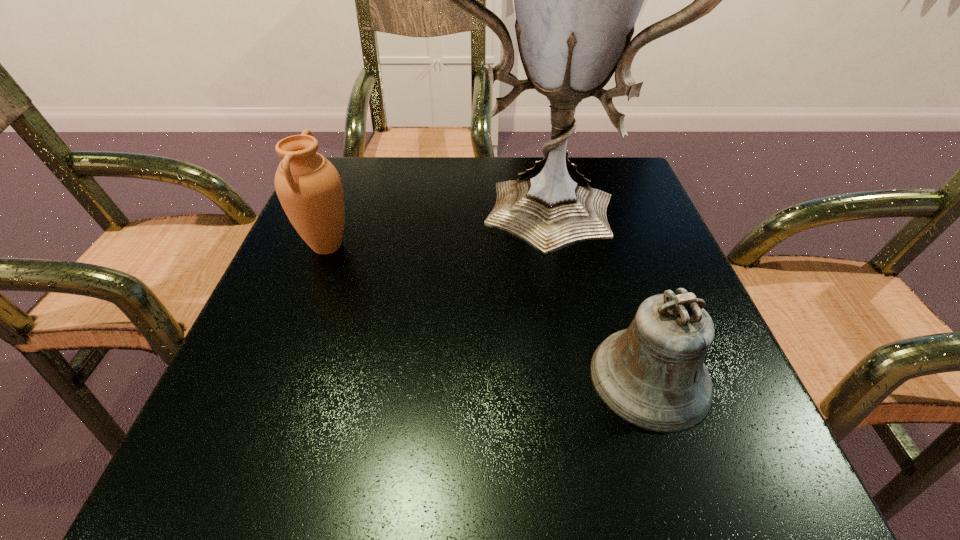
This screenshot has width=960, height=540. I want to click on empty location between the leftmost object and the tallest object, so click(430, 225).

This screenshot has width=960, height=540. In order to click on object that is the closest to the trophy cup in this screenshot , I will do `click(652, 375)`.

Locate which object is the second closest to the trophy cup. Please provide its 2D coordinates. Your answer should be formatted as a tuple, i.e. [(x, y)], where the tuple contains the x and y coordinates of a point satisfying the conditions above.

[(309, 188)]

Locate an element on the screen. vacant region that satisfies the following two spatial constraints: 1. on the front side of the nearest object; 2. on the right side of the tallest object is located at coordinates (558, 377).

This screenshot has height=540, width=960. I want to click on free space that satisfies the following two spatial constraints: 1. on the front side of the leftmost object; 2. on the left side of the shortest object, so click(x=276, y=377).

The image size is (960, 540). I want to click on vacant position in the image that satisfies the following two spatial constraints: 1. on the front side of the shortest object; 2. on the right side of the leftmost object, so click(x=276, y=377).